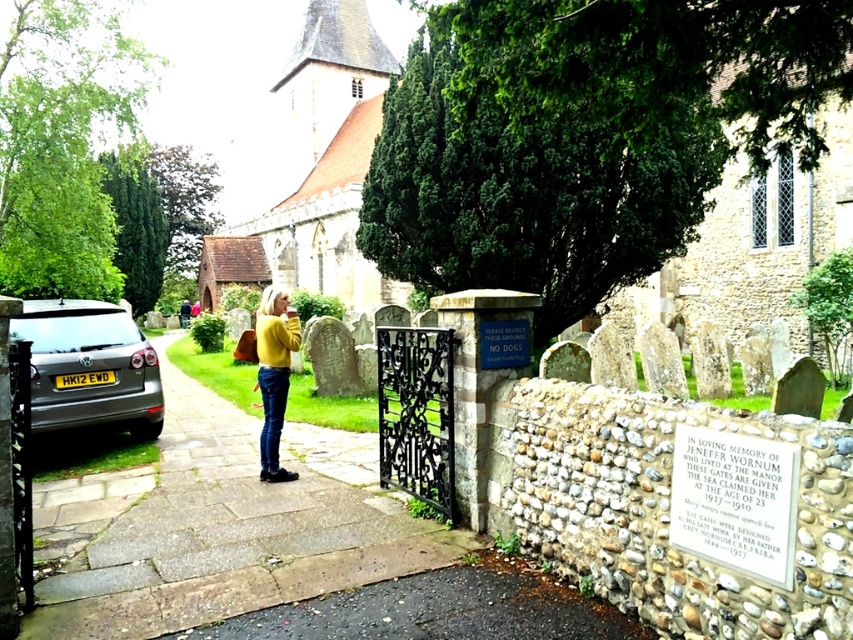
Which is more to the left, stone textured church at center or silver metallic car at left?

stone textured church at center is more to the left.

Does stone textured church at center lie in front of silver metallic car at left?

Yes.

Between point (315, 112) and point (62, 397), which one is positioned behind?

Positioned behind is point (315, 112).

Locate an element on the screen. stone textured church at center is located at coordinates (316, 156).

Can you confirm if silver metallic car at left is bigger than yellow knitwear at center?

No.

Is silver metallic car at left positioned at the back of yellow knitwear at center?

That is True.

Is point (51, 340) farther from camera compared to point (273, 451)?

Yes.

Identify the location of silver metallic car at left. Image resolution: width=853 pixels, height=640 pixels. (90, 368).

Can you confirm if stone textured church at center is positioned to the left of yellow knitwear at center?

Incorrect, stone textured church at center is not on the left side of yellow knitwear at center.

Is the position of stone textured church at center more distant than that of yellow knitwear at center?

Yes, stone textured church at center is behind yellow knitwear at center.

Where is `stone textured church at center`? The width and height of the screenshot is (853, 640). stone textured church at center is located at coordinates (316, 156).